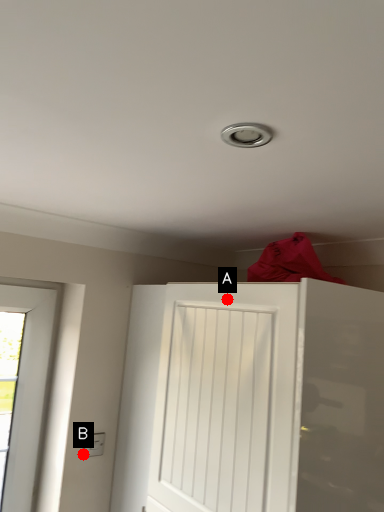
Question: Two points are circled on the image, labeled by A and B beside each circle. Which point is further to the camera?

Choices:
 (A) A is further
 (B) B is further

Answer: (B)